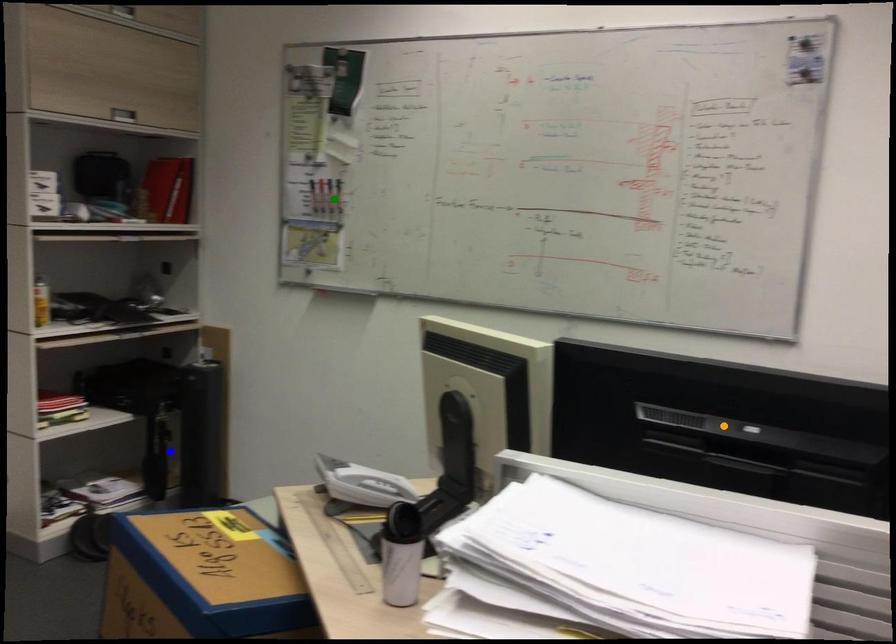
Order these from farthest to nearest:
orange point | green point | blue point

blue point → green point → orange point